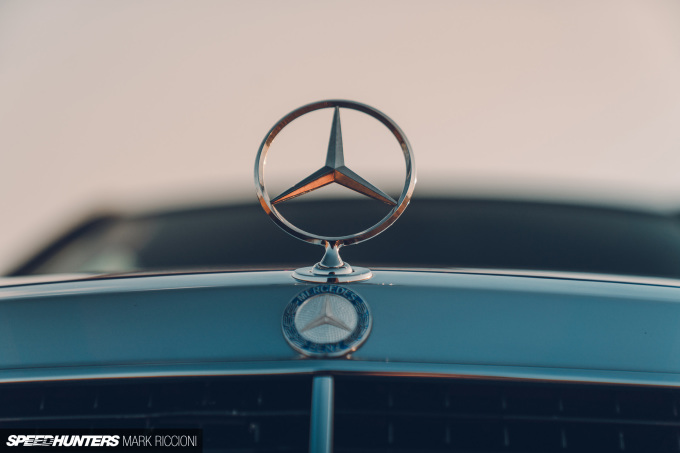
This screenshot has height=453, width=680. What are the coordinates of `window` in the screenshot? It's located at (494, 225).